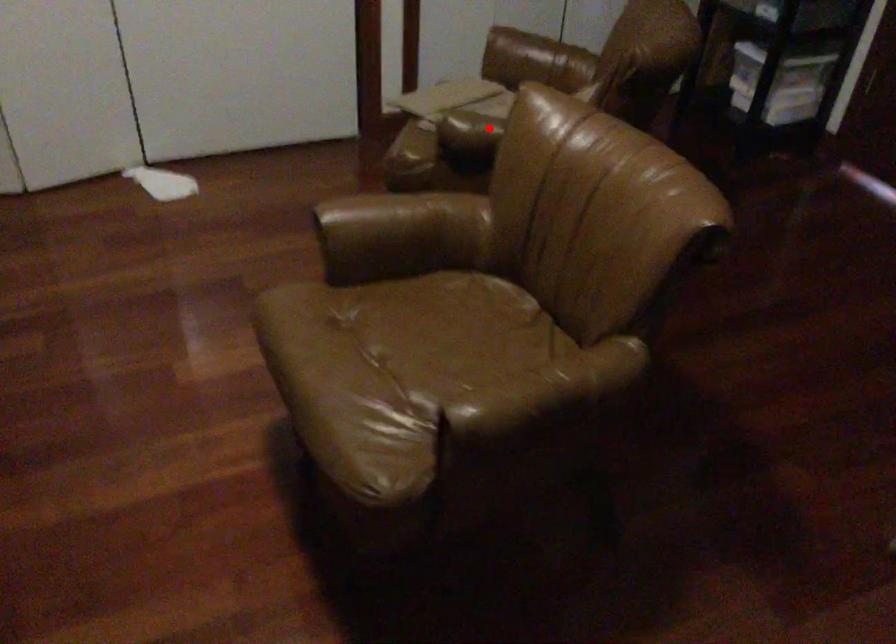
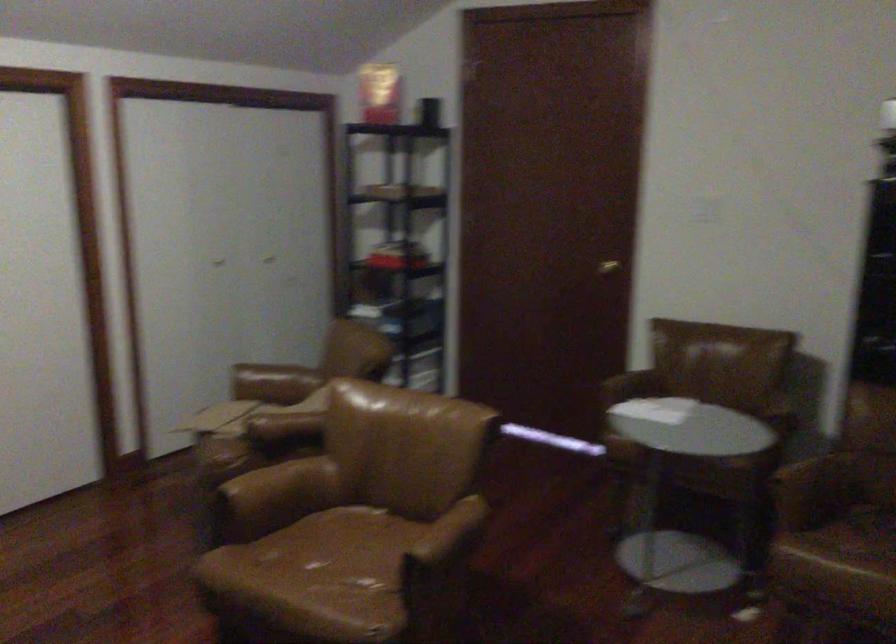
Question: I am providing you with two images of the same scene from different viewpoints. In image1, a red point is highlighted. Considering the same 3D point in image2, which of the following is correct?

Choices:
 (A) It is closer
 (B) It is farther

Answer: (B)